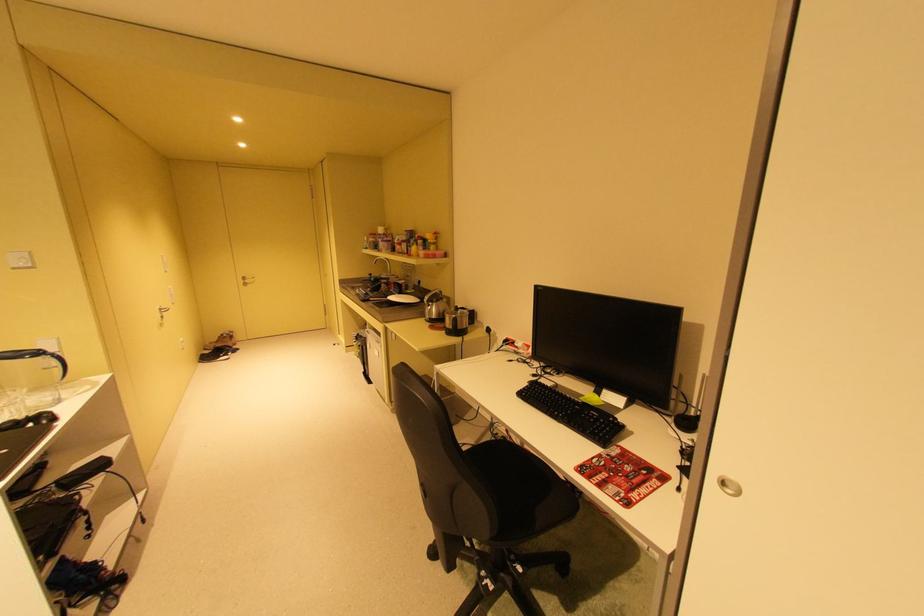
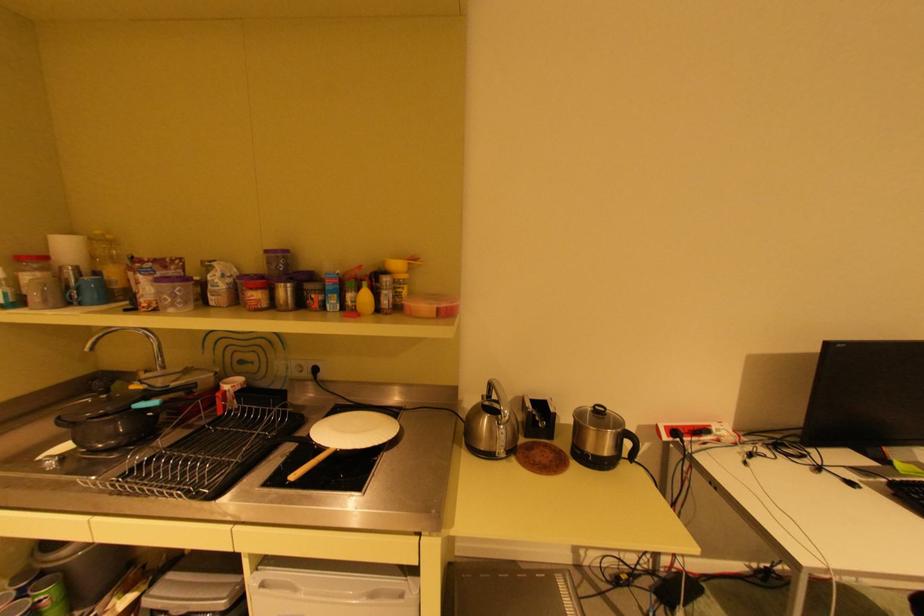
Find the pixel in the second image that matches pixel 384 249 in the first image.

(79, 302)